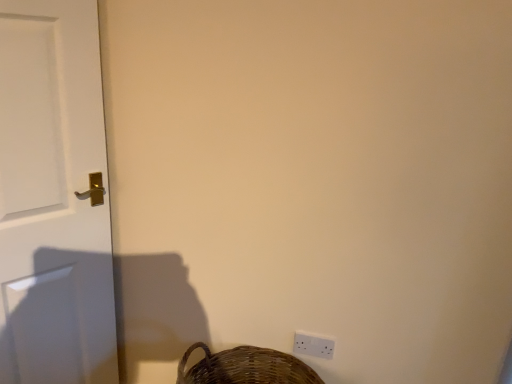
Question: Are brown woven basket at lower right and white plastic light switch at lower right far apart?

Choices:
 (A) yes
 (B) no

Answer: (B)

Question: From a real-world perspective, does brown woven basket at lower right stand above white plastic light switch at lower right?

Choices:
 (A) yes
 (B) no

Answer: (B)

Question: Considering the relative positions of brown woven basket at lower right and white plastic light switch at lower right in the image provided, is brown woven basket at lower right to the left of white plastic light switch at lower right from the viewer's perspective?

Choices:
 (A) no
 (B) yes

Answer: (B)

Question: From a real-world perspective, is brown woven basket at lower right physically below white plastic light switch at lower right?

Choices:
 (A) yes
 (B) no

Answer: (A)

Question: Is brown woven basket at lower right oriented away from white plastic light switch at lower right?

Choices:
 (A) yes
 (B) no

Answer: (A)

Question: Is brown woven basket at lower right not inside white plastic light switch at lower right?

Choices:
 (A) no
 (B) yes

Answer: (B)

Question: From a real-world perspective, is brown woven basket at lower right physically below white glossy door at left?

Choices:
 (A) no
 (B) yes

Answer: (B)

Question: Is brown woven basket at lower right closer to camera compared to white glossy door at left?

Choices:
 (A) yes
 (B) no

Answer: (B)

Question: Considering the relative positions of brown woven basket at lower right and white glossy door at left in the image provided, is brown woven basket at lower right to the left of white glossy door at left from the viewer's perspective?

Choices:
 (A) no
 (B) yes

Answer: (A)

Question: From the image's perspective, is brown woven basket at lower right located beneath white glossy door at left?

Choices:
 (A) no
 (B) yes

Answer: (B)

Question: From a real-world perspective, is brown woven basket at lower right positioned over white glossy door at left based on gravity?

Choices:
 (A) yes
 (B) no

Answer: (B)

Question: Can you confirm if brown woven basket at lower right is smaller than white glossy door at left?

Choices:
 (A) no
 (B) yes

Answer: (B)

Question: Considering the relative sizes of white plastic light switch at lower right and brown woven basket at lower right in the image provided, is white plastic light switch at lower right wider than brown woven basket at lower right?

Choices:
 (A) no
 (B) yes

Answer: (A)